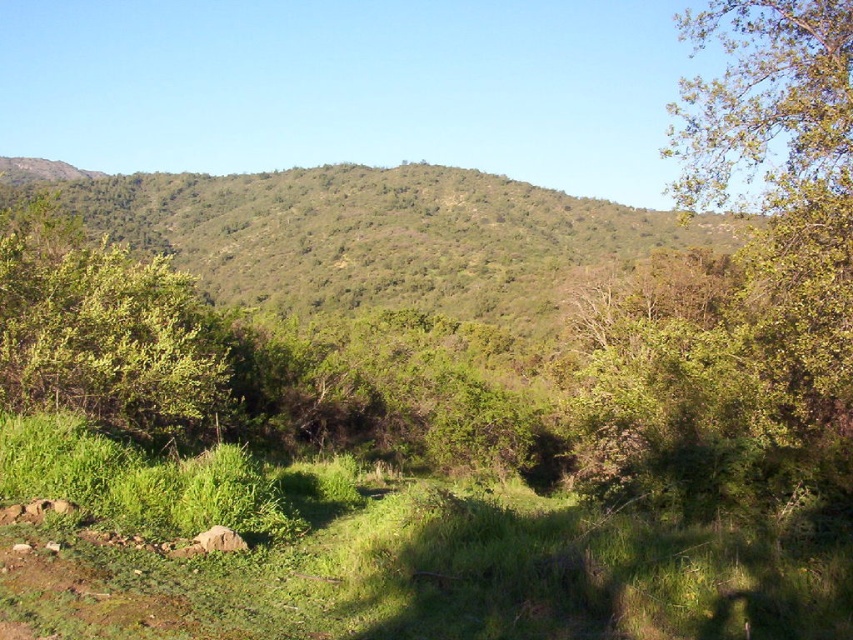
You are standing at the base of the green leafy hillside at center and want to walk to the green leafy bush at left. Which direction should you head to reach the bush?

The green leafy bush at left is located below the green leafy hillside at center, so you should head downward to reach the bush.

You are standing in the middle of the landscape and want to walk towards the green leafy hillside at center. Which direction should you move relative to the green leafy bush at left?

The green leafy hillside at center is to the right of the green leafy bush at left, so you should move towards the right direction relative to the green leafy bush at left.

From the picture: You are a hiker planning to cross the landscape. You see the green leafy hillside at center and the green leafy bush at left. Which one do you need to climb over because it is taller?

The green leafy hillside at center is taller than the green leafy bush at left, so you need to climb over the green leafy hillside at center.